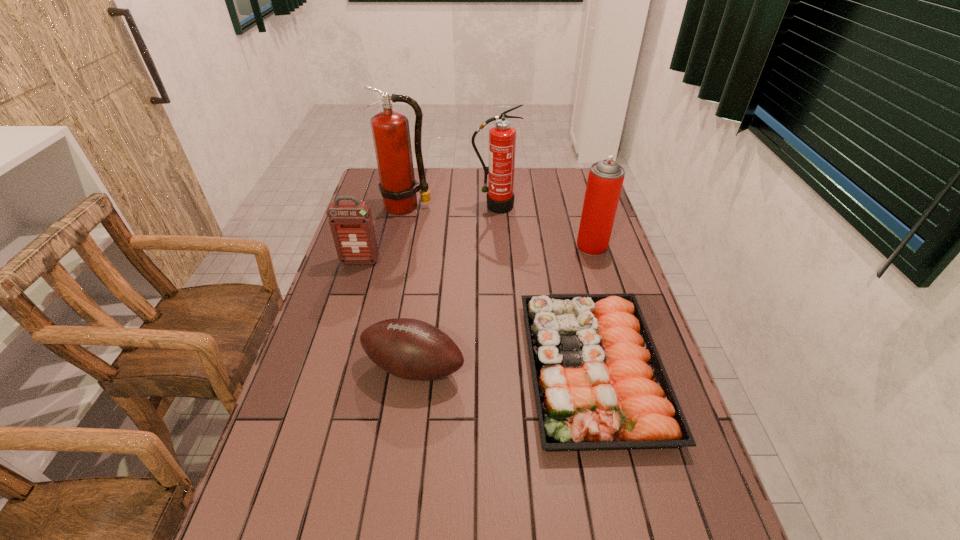
Where is `vacant area between the third shortest object and the shortest object`? This screenshot has width=960, height=540. vacant area between the third shortest object and the shortest object is located at coordinates (476, 315).

At what (x,y) coordinates should I click in order to perform the action: click on unoccupied position between the left fire extinguisher and the fourth shortest object. Please return your answer as a coordinate pair (x, y). This screenshot has width=960, height=540. Looking at the image, I should click on (499, 226).

Locate an element on the screen. vacant region between the right fire extinguisher and the fifth tallest object is located at coordinates (454, 287).

I want to click on free space that is in between the shortest object and the right fire extinguisher, so click(544, 288).

Identify the location of vacant space that's between the fourth tallest object and the football (American). The width and height of the screenshot is (960, 540). point(387,314).

Where is `object that is the fifth closest one to the shorter fire extinguisher`? This screenshot has width=960, height=540. object that is the fifth closest one to the shorter fire extinguisher is located at coordinates (411, 349).

Locate an element on the screen. The height and width of the screenshot is (540, 960). object that is the fourth closest one to the fourth farthest object is located at coordinates [599, 382].

Where is `free space that satisfies the following two spatial constraints: 1. at the nozzle of the aerosol can; 2. on the left side of the left fire extinguisher`? The image size is (960, 540). free space that satisfies the following two spatial constraints: 1. at the nozzle of the aerosol can; 2. on the left side of the left fire extinguisher is located at coordinates (397, 246).

You are a GUI agent. You are given a task and a screenshot of the screen. Output one action in this format:
    pyautogui.click(x=<x>, y=<y>)
    Task: Click on the free point that satisfies the following two spatial constraints: 1. at the nozzle of the left fire extinguisher; 2. on the right side of the second shortest object
    Image resolution: width=960 pixels, height=540 pixels.
    Given the screenshot: What is the action you would take?
    pyautogui.click(x=371, y=367)

Identify the location of free spot that satisfies the following two spatial constraints: 1. on the front-facing side of the platter; 2. on the left side of the shorter fire extinguisher. (502, 369).